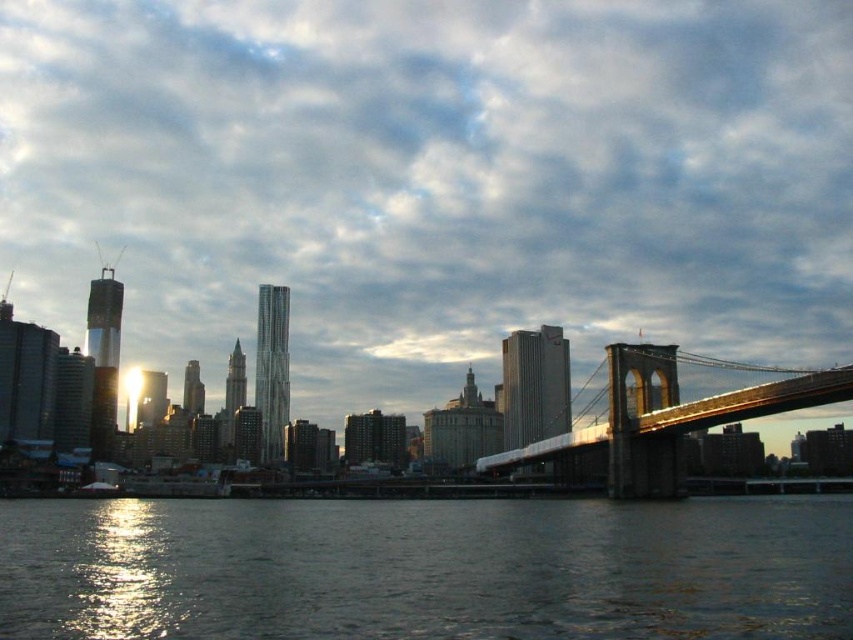
Does cloudy sky at upper center have a smaller size compared to metallic brown bridge at right?

Actually, cloudy sky at upper center might be larger than metallic brown bridge at right.

Does cloudy sky at upper center appear on the right side of metallic brown bridge at right?

In fact, cloudy sky at upper center is to the left of metallic brown bridge at right.

Does point (357, 388) come closer to viewer compared to point (624, 356)?

No, (357, 388) is further to viewer.

Identify the location of cloudy sky at upper center. (431, 179).

Is dark water at lower center above metallic brown bridge at right?

No, dark water at lower center is not above metallic brown bridge at right.

Does point (238, 621) come in front of point (680, 445)?

That is True.

Locate an element on the screen. The image size is (853, 640). dark water at lower center is located at coordinates (426, 570).

Is cloudy sky at upper center closer to camera compared to dark water at lower center?

No, it is not.

Which is behind, point (451, 38) or point (424, 595)?

The point (451, 38) is more distant.

Image resolution: width=853 pixels, height=640 pixels. Identify the location of cloudy sky at upper center. (431, 179).